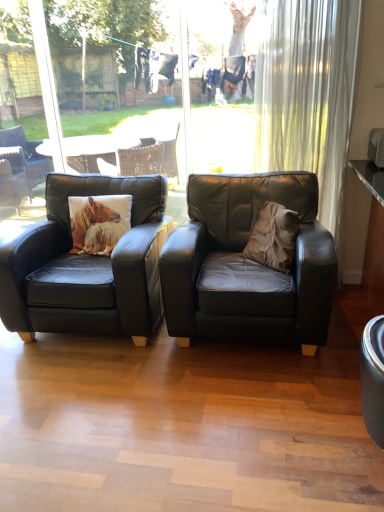
Question: Considering the positions of transparent glass window at center and white sheer curtain at upper right in the image, is transparent glass window at center wider or thinner than white sheer curtain at upper right?

Choices:
 (A) thin
 (B) wide

Answer: (A)

Question: Does point (29, 16) appear closer or farther from the camera than point (337, 181)?

Choices:
 (A) closer
 (B) farther

Answer: (B)

Question: Considering the real-world distances, which object is closest to the white textured pillow at left?

Choices:
 (A) black leather chair at center, placed as the first chair when sorted from left to right
 (B) transparent glass window at center
 (C) matte black armchair at center, the second chair when ordered from left to right
 (D) brown suede throw pillow at center
 (E) white sheer curtain at upper right

Answer: (A)

Question: Which object is positioned farthest from the transparent glass window at center?

Choices:
 (A) matte black armchair at center, the second chair when ordered from left to right
 (B) white sheer curtain at upper right
 (C) black leather chair at center, placed as the first chair when sorted from left to right
 (D) brown suede throw pillow at center
 (E) white textured pillow at left

Answer: (B)